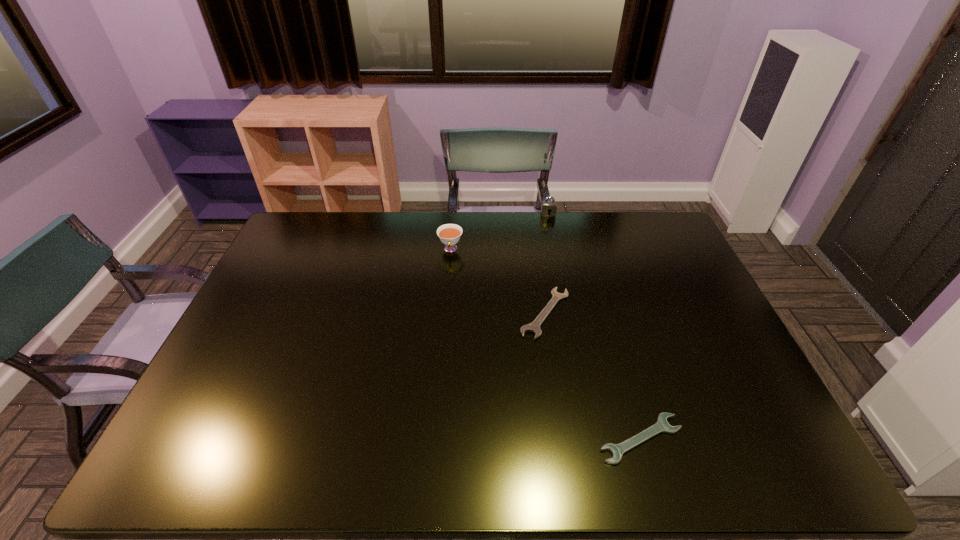
This screenshot has height=540, width=960. Find the location of `teacup at the far edge`. teacup at the far edge is located at coordinates (449, 234).

At what (x,y) coordinates should I click in order to perform the action: click on object situated at the near edge. Please return your answer as a coordinate pair (x, y). The image size is (960, 540). Looking at the image, I should click on (662, 426).

This screenshot has width=960, height=540. Identify the location of free space at the far edge of the desktop. (424, 238).

Where is `free space at the near edge`? This screenshot has width=960, height=540. free space at the near edge is located at coordinates (619, 442).

Where is `free region at the left edge of the desktop`? This screenshot has height=540, width=960. free region at the left edge of the desktop is located at coordinates (234, 342).

Locate an element on the screen. The image size is (960, 540). vacant space at the right edge of the desktop is located at coordinates (660, 263).

Locate an element on the screen. The image size is (960, 540). free region at the far left corner is located at coordinates (293, 240).

In the image, there is a desktop. Where is `vacant space at the near left corner`? This screenshot has height=540, width=960. vacant space at the near left corner is located at coordinates tap(171, 456).

This screenshot has width=960, height=540. I want to click on free space at the far right corner of the desktop, so click(650, 233).

Find the location of `vacant space in between the farther wrench and the nearest object`. vacant space in between the farther wrench and the nearest object is located at coordinates (593, 376).